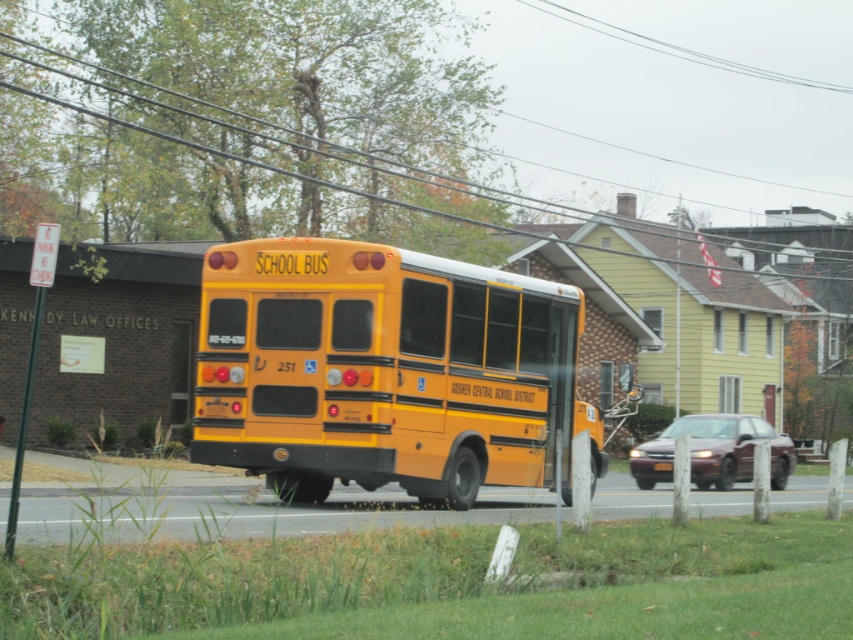
You are a delivery driver who needs to park your truck behind the maroon glossy sedan at center without hitting the black wire at upper center. Is there enough vertical clearance for your truck?

The black wire at upper center is taller than maroon glossy sedan at center, so yes, there is enough vertical clearance for your truck to park behind the maroon glossy sedan at center without hitting the wire.

You are a driver trying to parallel park your car behind the yellow matte school bus at center and the maroon glossy sedan at center. Which vehicle should you park behind to have more space available for your car?

You should park behind the yellow matte school bus at center because it occupies less space than the maroon glossy sedan at center, leaving more room for your car.